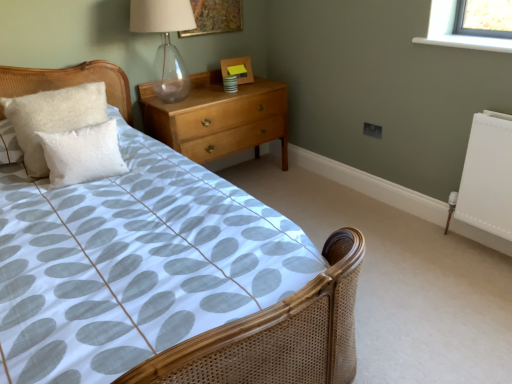
Question: Are wooden picture frame at upper center, the 2th picture frame viewed from the top, and white fluffy pillow at left, the 2th pillow in the back-to-front sequence, located far from each other?

Choices:
 (A) no
 (B) yes

Answer: (B)

Question: Does wooden picture frame at upper center, acting as the 1th picture frame starting from the bottom, have a larger size compared to white fluffy pillow at left, the 1th pillow viewed from the front?

Choices:
 (A) yes
 (B) no

Answer: (B)

Question: Could you tell me if wooden picture frame at upper center, the 2th picture frame viewed from the top, is turned towards white fluffy pillow at left, the 1th pillow viewed from the front?

Choices:
 (A) no
 (B) yes

Answer: (A)

Question: Does wooden picture frame at upper center, the 2th picture frame viewed from the top, have a smaller size compared to white fluffy pillow at left, the 2th pillow in the back-to-front sequence?

Choices:
 (A) no
 (B) yes

Answer: (B)

Question: Is wooden picture frame at upper center, the 2th picture frame viewed from the top, taller than white fluffy pillow at left, the 2th pillow in the back-to-front sequence?

Choices:
 (A) no
 (B) yes

Answer: (A)

Question: Visually, is white fluffy pillow at left, the 1th pillow viewed from the front, positioned to the left or to the right of light wood/dark finish chest of drawers at upper center?

Choices:
 (A) right
 (B) left

Answer: (B)

Question: Is point (66, 162) closer or farther from the camera than point (250, 84)?

Choices:
 (A) farther
 (B) closer

Answer: (B)

Question: Is white fluffy pillow at left, the 1th pillow viewed from the front, inside or outside of light wood/dark finish chest of drawers at upper center?

Choices:
 (A) inside
 (B) outside

Answer: (B)

Question: From the image's perspective, relative to light wood/dark finish chest of drawers at upper center, is white fluffy pillow at left, the 2th pillow in the back-to-front sequence, above or below?

Choices:
 (A) below
 (B) above

Answer: (A)

Question: From the image's perspective, is white fluffy pillow at left, the 2th pillow in the back-to-front sequence, located above or below transparent glass table lamp at upper center?

Choices:
 (A) below
 (B) above

Answer: (A)

Question: From a real-world perspective, is white fluffy pillow at left, the 1th pillow viewed from the front, above or below transparent glass table lamp at upper center?

Choices:
 (A) above
 (B) below

Answer: (B)

Question: Do you think white fluffy pillow at left, the 1th pillow viewed from the front, is within transparent glass table lamp at upper center, or outside of it?

Choices:
 (A) inside
 (B) outside

Answer: (B)

Question: Does point (56, 152) appear closer or farther from the camera than point (140, 3)?

Choices:
 (A) closer
 (B) farther

Answer: (A)

Question: Considering the positions of point pos(159,56) and point pos(74,91), is point pos(159,56) closer or farther from the camera than point pos(74,91)?

Choices:
 (A) farther
 (B) closer

Answer: (A)

Question: In terms of height, does transparent glass table lamp at upper center look taller or shorter compared to white fluffy pillow at upper left, the 1th pillow viewed from the back?

Choices:
 (A) short
 (B) tall

Answer: (B)